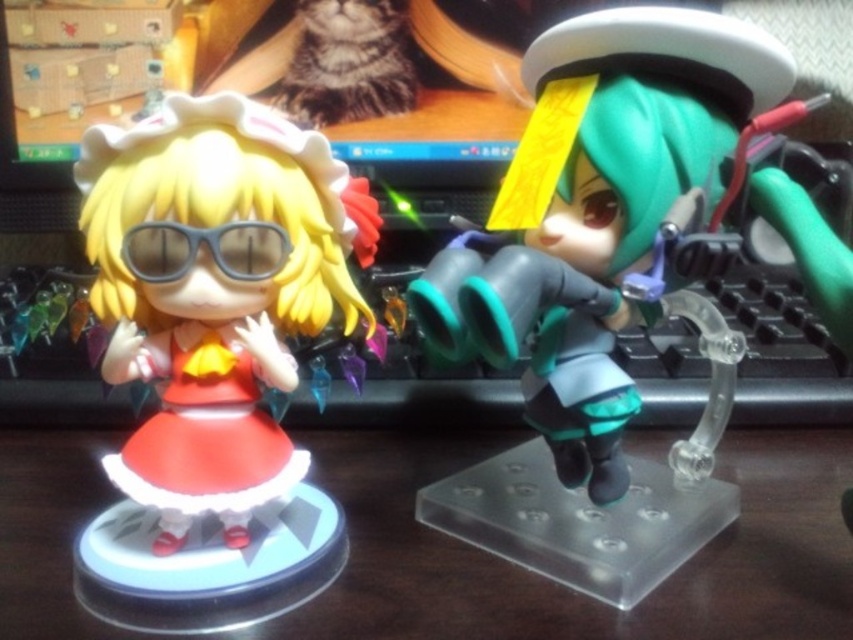
In the scene shown: Which is below, teal matte figure at right or wooden table at center?

Positioned lower is wooden table at center.

Who is positioned more to the left, teal matte figure at right or wooden table at center?

wooden table at center is more to the left.

Which is in front, point (584, 29) or point (715, 624)?

Positioned in front is point (715, 624).

At what (x,y) coordinates should I click in order to perform the action: click on teal matte figure at right. Please return your answer as a coordinate pair (x, y). Image resolution: width=853 pixels, height=640 pixels. Looking at the image, I should click on (598, 211).

Which of these two, teal matte figure at right or matte black figurine at left, stands taller?

teal matte figure at right

Is teal matte figure at right positioned behind matte black figurine at left?

No.

Does point (611, 72) come farther from viewer compared to point (189, 460)?

Yes, it is behind point (189, 460).

The image size is (853, 640). What are the coordinates of `teal matte figure at right` in the screenshot? It's located at (598, 211).

Does point (587, 61) come behind point (137, 264)?

Yes, it is.

Consider the image. Who is positioned more to the left, teal matte figure at right or matte black goggles at left?

matte black goggles at left

Which is in front, point (532, 93) or point (144, 248)?

Point (144, 248) is in front.

Locate an element on the screen. The height and width of the screenshot is (640, 853). teal matte figure at right is located at coordinates (598, 211).